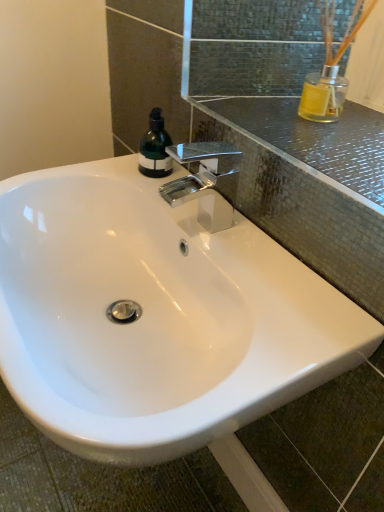
This screenshot has height=512, width=384. What do you see at coordinates (155, 316) in the screenshot? I see `white glossy sink at center` at bounding box center [155, 316].

Find the location of a particular element. Image resolution: width=384 pixels, height=512 pixels. white glossy sink at center is located at coordinates (155, 316).

Where is `transparent glass mirror at upper center`? The height and width of the screenshot is (512, 384). transparent glass mirror at upper center is located at coordinates (284, 87).

How many degrees apart are the facing directions of white glossy sink at center and transparent glass mirror at upper center?

0.127 degrees separate the facing orientations of white glossy sink at center and transparent glass mirror at upper center.

Which is more to the right, white glossy sink at center or transparent glass mirror at upper center?

transparent glass mirror at upper center is more to the right.

Is white glossy sink at center oriented away from transparent glass mirror at upper center?

white glossy sink at center is not turned away from transparent glass mirror at upper center.

At what (x,y) coordinates should I click in order to perform the action: click on mirror on the right side of white glossy sink at center. Please return your answer as a coordinate pair (x, y). Looking at the image, I should click on (284, 87).

From the picture: Is transparent glass mirror at upper center next to polished chrome faucet at upper center?

They are not placed beside each other.

Considering the sizes of objects transparent glass mirror at upper center and polished chrome faucet at upper center in the image provided, who is thinner, transparent glass mirror at upper center or polished chrome faucet at upper center?

Thinner between the two is polished chrome faucet at upper center.

Identify the location of tap on the left of the transparent glass mirror at upper center. (206, 182).

Does transparent glass mirror at upper center have a larger size compared to polished chrome faucet at upper center?

Correct, transparent glass mirror at upper center is larger in size than polished chrome faucet at upper center.

Is white glossy sink at center looking in the opposite direction of green matte bottle at upper left?

No.

How different are the orientations of white glossy sink at center and green matte bottle at upper left in degrees?

white glossy sink at center and green matte bottle at upper left are facing 3.4 degrees away from each other.

Which object is positioned more to the left, white glossy sink at center or green matte bottle at upper left?

white glossy sink at center is more to the left.

Which of these two, white glossy sink at center or green matte bottle at upper left, stands shorter?

green matte bottle at upper left is shorter.

Is polished chrome faucet at upper center shorter than transparent glass mirror at upper center?

Incorrect, the height of polished chrome faucet at upper center does not fall short of that of transparent glass mirror at upper center.

What's the angular difference between polished chrome faucet at upper center and transparent glass mirror at upper center's facing directions?

There is a 0.126-degree angle between the facing directions of polished chrome faucet at upper center and transparent glass mirror at upper center.

From the picture: Is polished chrome faucet at upper center turned away from transparent glass mirror at upper center?

Yes, polished chrome faucet at upper center is positioned with its back facing transparent glass mirror at upper center.

Does polished chrome faucet at upper center touch transparent glass mirror at upper center?

There is a gap between polished chrome faucet at upper center and transparent glass mirror at upper center.

From the image's perspective, is green matte bottle at upper left located above or below polished chrome faucet at upper center?

Clearly, from the image's perspective, green matte bottle at upper left is above polished chrome faucet at upper center.

From the picture: Is green matte bottle at upper left far from polished chrome faucet at upper center?

No, there isn't a large distance between green matte bottle at upper left and polished chrome faucet at upper center.

Which object is more forward, green matte bottle at upper left or polished chrome faucet at upper center?

polished chrome faucet at upper center.

Does transparent glass mirror at upper center have a larger size compared to green matte bottle at upper left?

Yes, transparent glass mirror at upper center is bigger than green matte bottle at upper left.

Image resolution: width=384 pixels, height=512 pixels. In order to click on mirror that appears in front of the green matte bottle at upper left in this screenshot , I will do `click(284, 87)`.

Considering the relative sizes of transparent glass mirror at upper center and green matte bottle at upper left in the image provided, is transparent glass mirror at upper center wider than green matte bottle at upper left?

Yes.

From a real-world perspective, is transparent glass mirror at upper center below green matte bottle at upper left?

No, from a real-world perspective, transparent glass mirror at upper center is not below green matte bottle at upper left.

Are green matte bottle at upper left and white glossy sink at center beside each other?

green matte bottle at upper left is not next to white glossy sink at center, and they're not touching.

Consider the image. Is green matte bottle at upper left inside or outside of white glossy sink at center?

green matte bottle at upper left is outside white glossy sink at center.

From a real-world perspective, is green matte bottle at upper left located beneath white glossy sink at center?

Incorrect, from a real-world perspective, green matte bottle at upper left is higher than white glossy sink at center.

Is green matte bottle at upper left closer to the viewer compared to white glossy sink at center?

That is False.

Image resolution: width=384 pixels, height=512 pixels. Identify the location of mirror behind the white glossy sink at center. (284, 87).

The height and width of the screenshot is (512, 384). In order to click on mirror located above the polished chrome faucet at upper center (from the image's perspective) in this screenshot , I will do `click(284, 87)`.

From the picture: Based on their spatial positions, is polished chrome faucet at upper center or transparent glass mirror at upper center further from green matte bottle at upper left?

Among the two, transparent glass mirror at upper center is located further to green matte bottle at upper left.

Based on their spatial positions, is polished chrome faucet at upper center or white glossy sink at center further from transparent glass mirror at upper center?

white glossy sink at center lies further to transparent glass mirror at upper center than the other object.

From the image, which object appears to be farther from transparent glass mirror at upper center, green matte bottle at upper left or white glossy sink at center?

white glossy sink at center.

Considering their positions, is transparent glass mirror at upper center positioned closer to white glossy sink at center than green matte bottle at upper left?

Based on the image, transparent glass mirror at upper center appears to be nearer to white glossy sink at center.

When comparing their distances from transparent glass mirror at upper center, does green matte bottle at upper left or polished chrome faucet at upper center seem closer?

Among the two, polished chrome faucet at upper center is located nearer to transparent glass mirror at upper center.

Looking at the image, which one is located closer to polished chrome faucet at upper center, white glossy sink at center or transparent glass mirror at upper center?

transparent glass mirror at upper center is positioned closer to the anchor polished chrome faucet at upper center.

Which object lies nearer to the anchor point polished chrome faucet at upper center, green matte bottle at upper left or transparent glass mirror at upper center?

Among the two, green matte bottle at upper left is located nearer to polished chrome faucet at upper center.

Which object lies further to the anchor point white glossy sink at center, green matte bottle at upper left or transparent glass mirror at upper center?

The object further to white glossy sink at center is green matte bottle at upper left.

Image resolution: width=384 pixels, height=512 pixels. I want to click on tap between transparent glass mirror at upper center and white glossy sink at center in the vertical direction, so click(x=206, y=182).

This screenshot has width=384, height=512. Find the location of `tap between white glossy sink at center and green matte bottle at upper left in the front-back direction`. tap between white glossy sink at center and green matte bottle at upper left in the front-back direction is located at coordinates (206, 182).

Locate an element on the screen. This screenshot has height=512, width=384. tap between green matte bottle at upper left and transparent glass mirror at upper center is located at coordinates (206, 182).

Identify the location of mirror that lies between green matte bottle at upper left and white glossy sink at center from top to bottom. (284, 87).